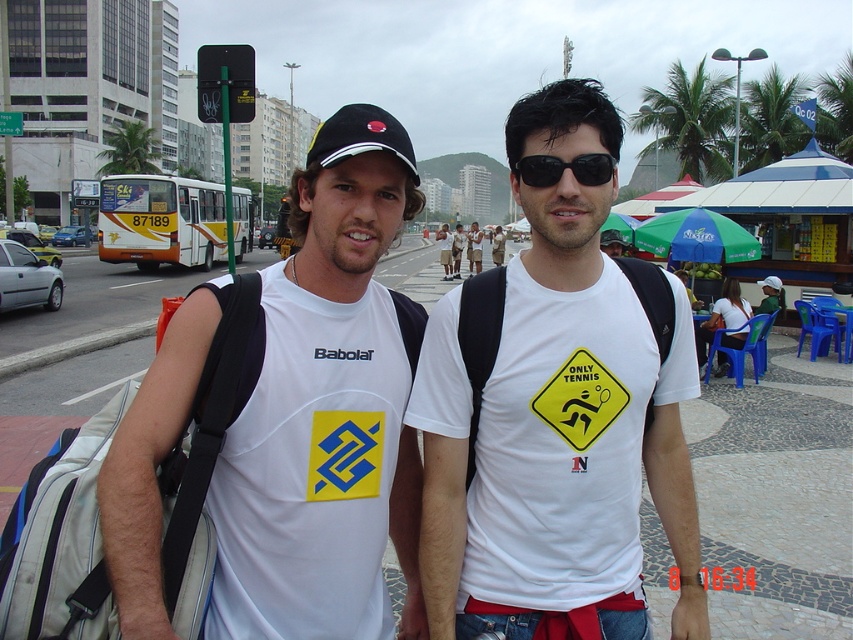
Is white fabric t-shirt at center to the left of green plastic traffic sign at upper center from the viewer's perspective?

No, white fabric t-shirt at center is not to the left of green plastic traffic sign at upper center.

The width and height of the screenshot is (853, 640). Describe the element at coordinates (326, 410) in the screenshot. I see `white fabric t-shirt at center` at that location.

Find the location of `white fabric t-shirt at center`. white fabric t-shirt at center is located at coordinates point(326,410).

How far apart are white fabric t-shirt at center and black plastic sunglasses at center?

16.16 inches

Can you confirm if white fabric t-shirt at center is smaller than black plastic sunglasses at center?

No, white fabric t-shirt at center is not smaller than black plastic sunglasses at center.

Between point (363, 499) and point (529, 164), which one is positioned behind?

Positioned behind is point (363, 499).

The height and width of the screenshot is (640, 853). I want to click on white fabric t-shirt at center, so click(x=326, y=410).

Is white matte t-shirt at center bigger than white plastic chair at lower right?

Actually, white matte t-shirt at center might be smaller than white plastic chair at lower right.

Which is more to the right, white matte t-shirt at center or white plastic chair at lower right?

white plastic chair at lower right is more to the right.

Measure the distance between white matte t-shirt at center and camera.

A distance of 1.78 meters exists between white matte t-shirt at center and camera.

Find the location of a particular element. white matte t-shirt at center is located at coordinates (556, 413).